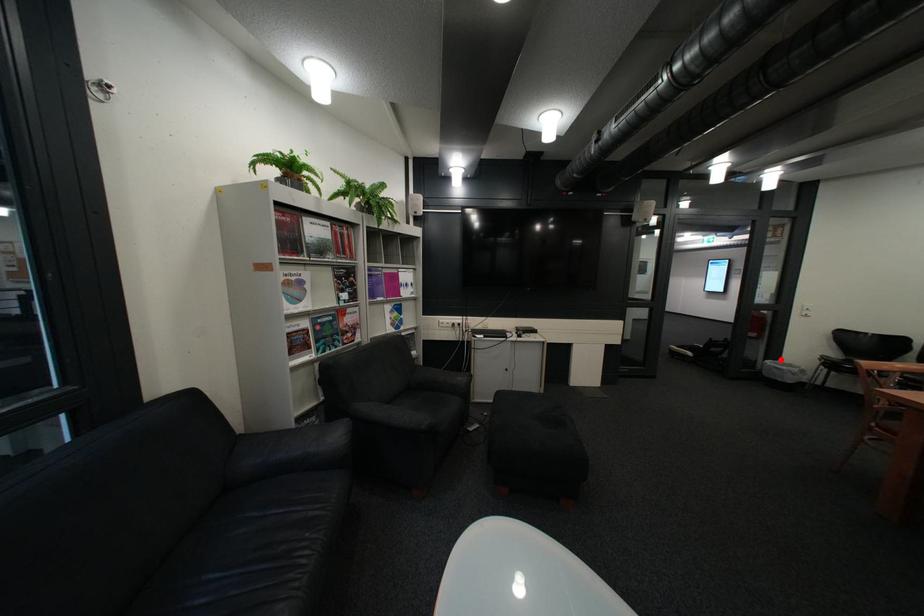
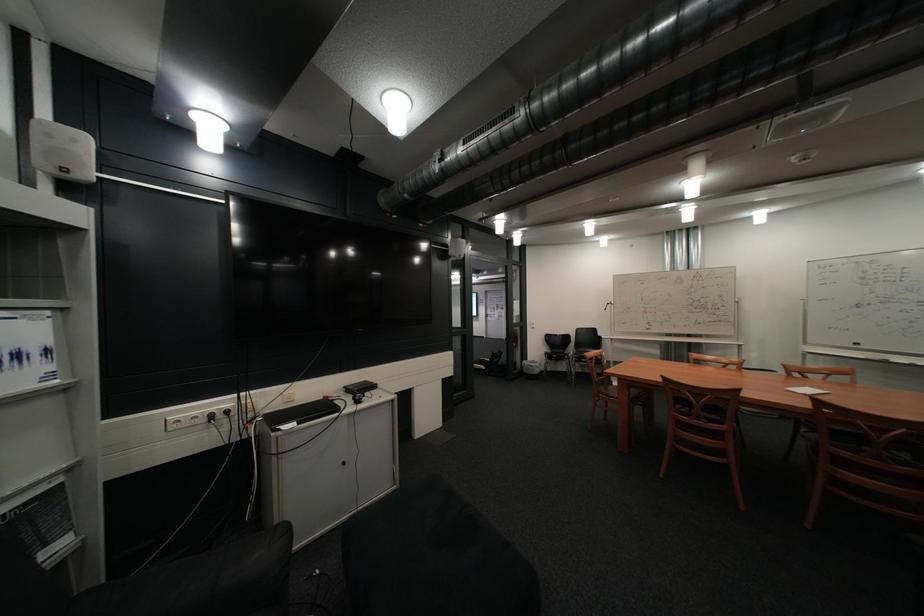
Where in the second image is the point corresponding to the highlighted location from the first image?

(537, 361)